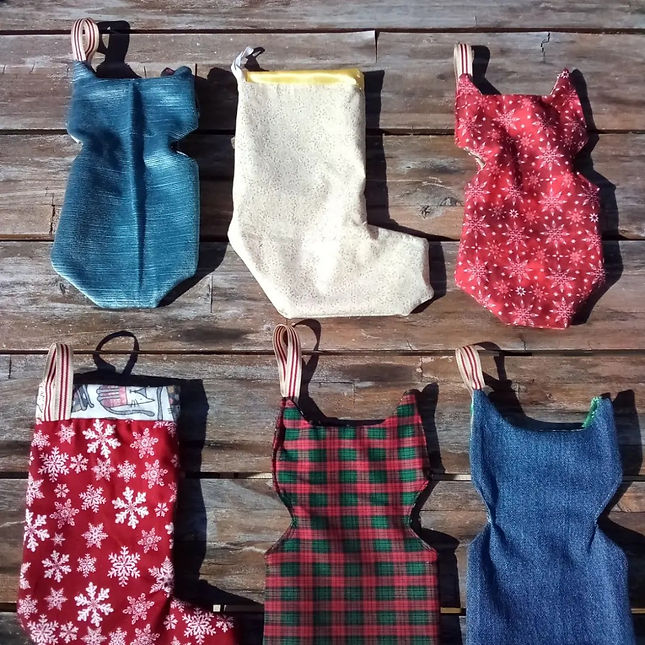
You are a GUI agent. You are given a task and a screenshot of the screen. Output one action in this format:
    pyautogui.click(x=<x>, y=<y>)
    Task: Click on the table
    This screenshot has width=645, height=645.
    Given the screenshot: What is the action you would take?
    pyautogui.click(x=237, y=324)